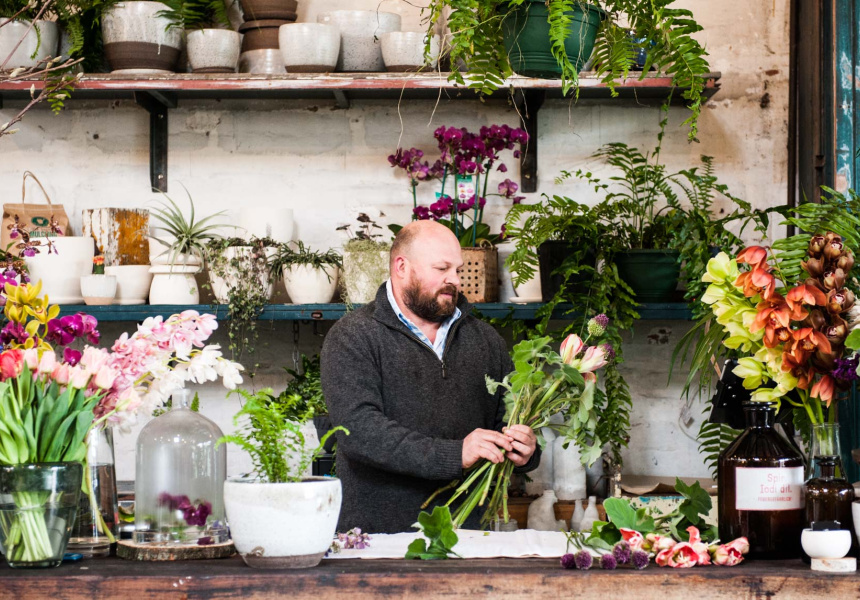
Where is `black bottled vases`? black bottled vases is located at coordinates (757, 525), (828, 518).